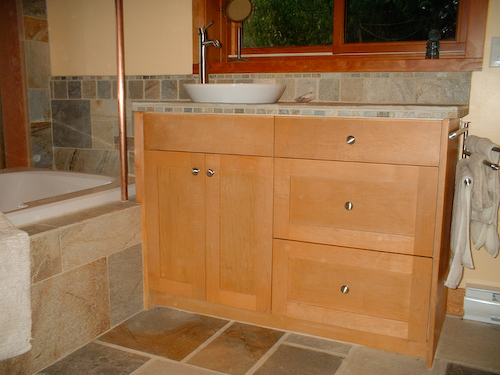
The height and width of the screenshot is (375, 500). In order to click on heat register in this screenshot , I will do `click(473, 304)`.